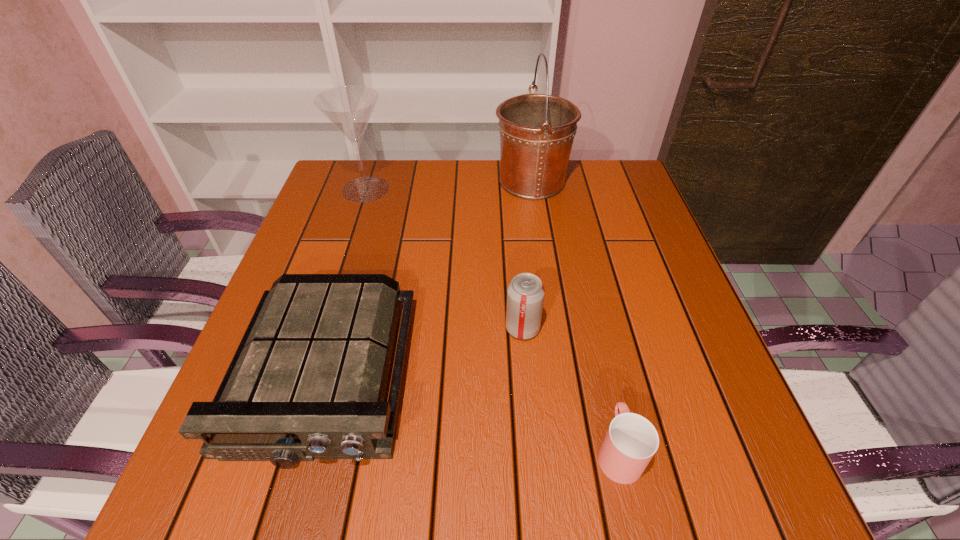
The image size is (960, 540). In order to click on free space between the cup and the flute glass in this screenshot , I will do `click(492, 320)`.

Find the location of a particular element. Image resolution: width=960 pixels, height=540 pixels. free space between the cup and the fourth shortest object is located at coordinates (492, 320).

Locate an element on the screen. free space that is in between the soda can and the fourth shortest object is located at coordinates (444, 259).

Identify the location of object that stands as the closest to the cup. (525, 294).

Select which object appears as the fourth closest to the third shortest object. Please provide its 2D coordinates. Your answer should be formatted as a tuple, i.e. [(x, y)], where the tuple contains the x and y coordinates of a point satisfying the conditions above.

[(349, 108)]

Locate an element on the screen. Image resolution: width=960 pixels, height=540 pixels. free space in the image that satisfies the following two spatial constraints: 1. on the back side of the flute glass; 2. on the left side of the tallest object is located at coordinates (369, 181).